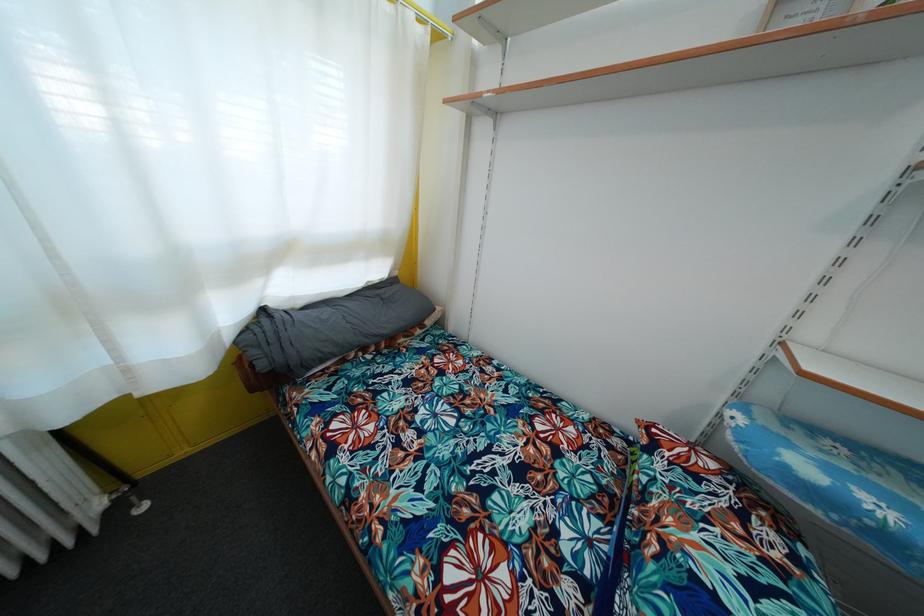
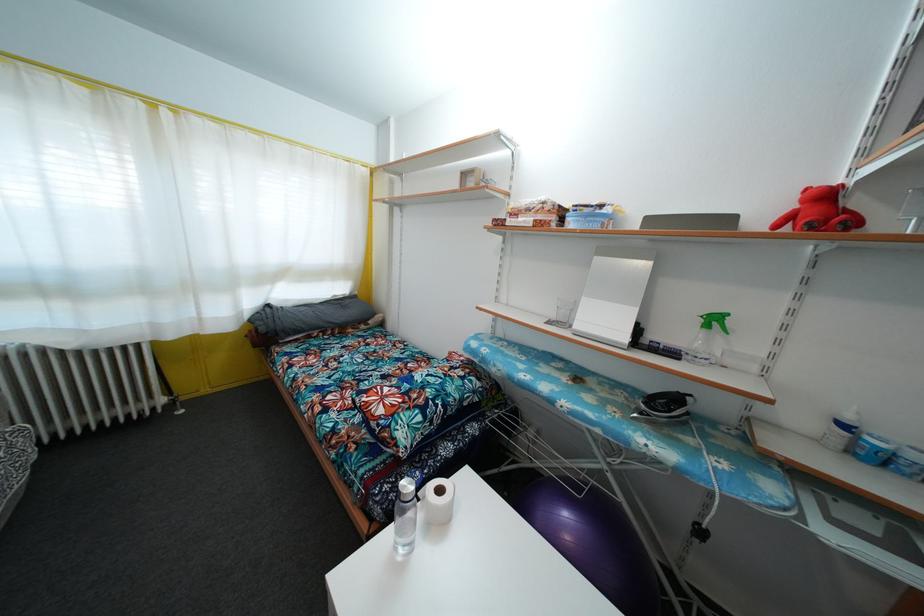
Locate, in the second image, the point that corresponds to point (399, 280) in the first image.

(359, 300)